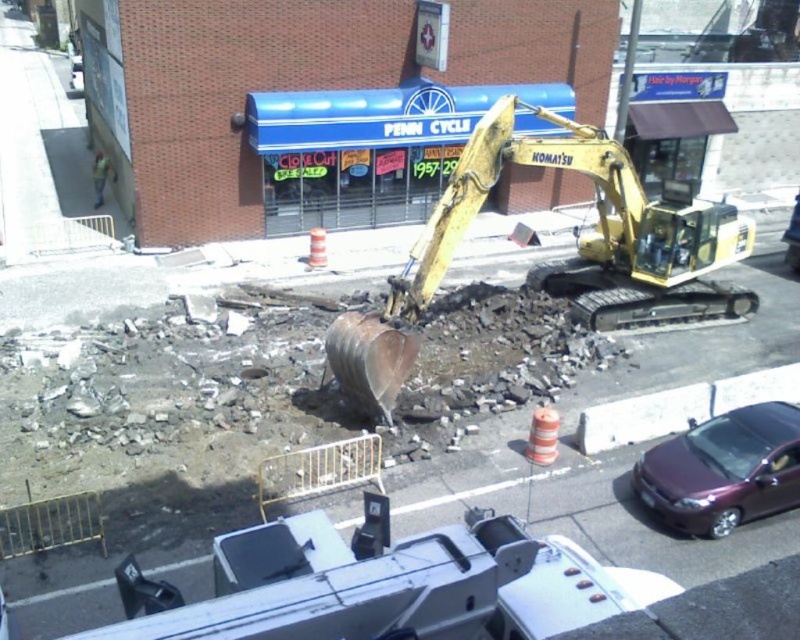
Looking at this image, you are a delivery person trying to navigate through the construction area. You see the blue awning at center and the yellow reflective vest at left. Which object would block your path more if you try to go straight ahead?

The blue awning at center is larger in size than the yellow reflective vest at left, so the blue awning at center would block your path more if you try to go straight ahead.

From the picture: You are standing at the center of the construction site. You need to move your metallic purple sedan at lower right to a parking spot 10 meters north. Can you drive it directly north from its current position without moving any barricades?

The metallic purple sedan at lower right is located at point (x=724, y=470). Since the area around the excavation site is cordoned off by orange traffic cones and temporary metal barricades, you would need to move the barricades to drive the metallic purple sedan at lower right directly north to the parking spot.